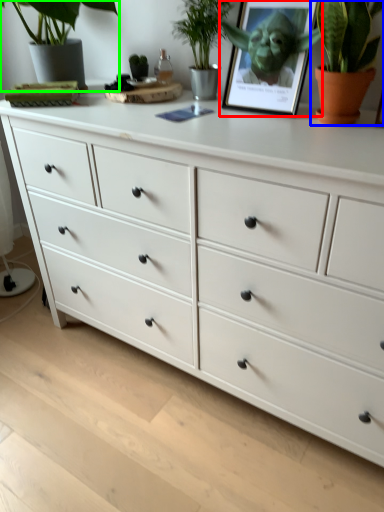
Question: Which is nearer to the picture frame (highlighted by a red box)? houseplant (highlighted by a blue box) or houseplant (highlighted by a green box).

Choices:
 (A) houseplant
 (B) houseplant

Answer: (A)